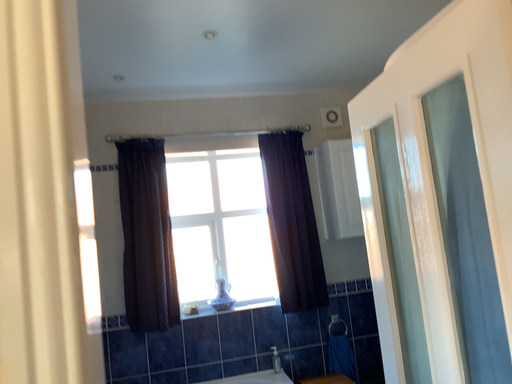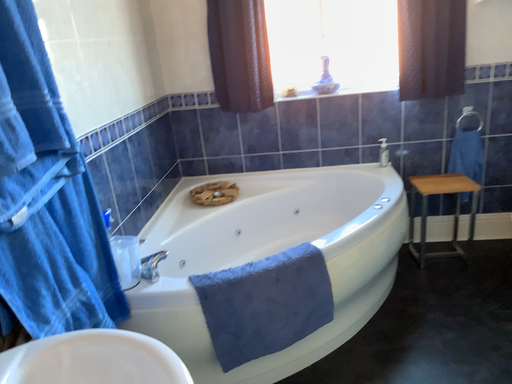
Question: Which way did the camera rotate in the video?

Choices:
 (A) rotated upward
 (B) rotated downward

Answer: (B)